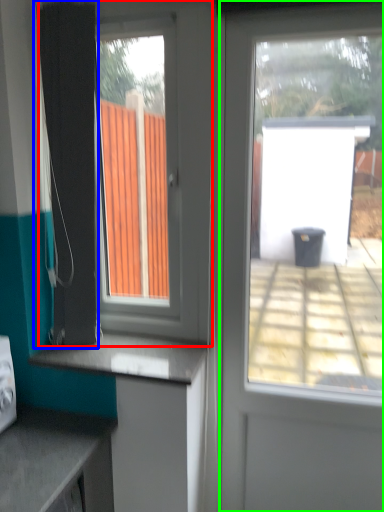
Question: Which is nearer to the window (highlighted by a red box)? shower curtain (highlighted by a blue box) or door (highlighted by a green box).

Choices:
 (A) shower curtain
 (B) door

Answer: (A)